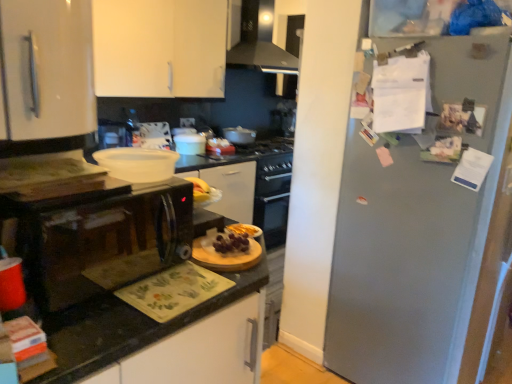
What do you see at coordinates (113, 272) in the screenshot?
I see `black granite countertop at center` at bounding box center [113, 272].

Where is `white matte cabinet at upper left`? The image size is (512, 384). white matte cabinet at upper left is located at coordinates (159, 48).

Describe the element at coordinates (239, 135) in the screenshot. I see `matte white pot at center, marked as the 2th appliance in a right-to-left arrangement` at that location.

The image size is (512, 384). Identify the location of white matte bowl at center. (137, 163).

Is metallic silver range hood at upper center in front of or behind yellow matte bananas at center, arranged as the second food when viewed from the front, in the image?

Clearly, metallic silver range hood at upper center is behind yellow matte bananas at center, arranged as the second food when viewed from the front.

Is metallic silver range hood at upper center to the left or to the right of yellow matte bananas at center, arranged as the second food when viewed from the front, in the image?

In the image, metallic silver range hood at upper center appears on the right side of yellow matte bananas at center, arranged as the second food when viewed from the front.

Does metallic silver range hood at upper center have a smaller size compared to yellow matte bananas at center, arranged as the second food when viewed from the front?

No, metallic silver range hood at upper center is not smaller than yellow matte bananas at center, arranged as the second food when viewed from the front.

Is metallic silver range hood at upper center far away from yellow matte bananas at center, which appears as the 2th food when ordered from the bottom?

Indeed, metallic silver range hood at upper center is not near yellow matte bananas at center, which appears as the 2th food when ordered from the bottom.

From a real-world perspective, is metallic silver range hood at upper center positioned over satin silver kettle at upper center, the third appliance when ordered from left to right, based on gravity?

Yes, from a real-world perspective, metallic silver range hood at upper center is on top of satin silver kettle at upper center, the third appliance when ordered from left to right.

Is metallic silver range hood at upper center positioned far away from satin silver kettle at upper center, the third appliance when ordered from left to right?

No, metallic silver range hood at upper center is in close proximity to satin silver kettle at upper center, the third appliance when ordered from left to right.

Considering the points (259, 15) and (275, 115), which point is in front, point (259, 15) or point (275, 115)?

The point (259, 15) is more forward.

Is the position of metallic silver range hood at upper center less distant than that of satin silver kettle at upper center, the first appliance when ordered from back to front?

Yes, it is in front of satin silver kettle at upper center, the first appliance when ordered from back to front.

Which of these two, white matte cabinet at upper left or slightly glossy wooden cutting board at center, placed as the 1th food when sorted from front to back, stands shorter?

Standing shorter between the two is slightly glossy wooden cutting board at center, placed as the 1th food when sorted from front to back.

From a real-world perspective, who is located lower, white matte cabinet at upper left or slightly glossy wooden cutting board at center, the 1th food viewed from the right?

slightly glossy wooden cutting board at center, the 1th food viewed from the right, from a real-world perspective.

Does white matte cabinet at upper left appear on the right side of slightly glossy wooden cutting board at center, the 1th food viewed from the right?

In fact, white matte cabinet at upper left is to the left of slightly glossy wooden cutting board at center, the 1th food viewed from the right.

Locate an element on the screen. The image size is (512, 384). home appliance behind the white matte cabinet at upper left is located at coordinates (260, 41).

Is metallic silver range hood at upper center inside the boundaries of white matte cabinet at upper left, or outside?

metallic silver range hood at upper center is outside white matte cabinet at upper left.

Does metallic silver range hood at upper center have a larger size compared to white matte cabinet at upper left?

Yes.

Is metallic silver range hood at upper center taller or shorter than white matte cabinet at upper left?

metallic silver range hood at upper center is shorter than white matte cabinet at upper left.

From the image's perspective, count 1st appliances downward from the white matte cabinet at upper left and point to it. Please provide its 2D coordinates.

[(284, 117)]

In the image, is white matte cabinet at upper left positioned in front of or behind satin silver kettle at upper center, the third appliance when ordered from left to right?

In the image, white matte cabinet at upper left appears in front of satin silver kettle at upper center, the third appliance when ordered from left to right.

Considering the sizes of white matte cabinet at upper left and satin silver kettle at upper center, the first appliance from the right, in the image, is white matte cabinet at upper left wider or thinner than satin silver kettle at upper center, the first appliance from the right,?

white matte cabinet at upper left is wider than satin silver kettle at upper center, the first appliance from the right.

Who is bigger, white matte cabinet at upper left or satin silver kettle at upper center, the first appliance from the right?

With larger size is white matte cabinet at upper left.

Considering their positions, is metallic silver range hood at upper center located in front of or behind metallic gray refrigerator at right?

In the image, metallic silver range hood at upper center appears behind metallic gray refrigerator at right.

Considering the relative positions of metallic silver range hood at upper center and metallic gray refrigerator at right in the image provided, is metallic silver range hood at upper center to the left or to the right of metallic gray refrigerator at right?

From the image, it's evident that metallic silver range hood at upper center is to the left of metallic gray refrigerator at right.

Is metallic silver range hood at upper center far away from metallic gray refrigerator at right?

Yes, metallic silver range hood at upper center and metallic gray refrigerator at right are located far from each other.

How many degrees apart are the facing directions of metallic silver range hood at upper center and metallic gray refrigerator at right?

91.8 degrees.

In the scene shown: Between metallic silver range hood at upper center and slightly glossy wooden cutting board at center, placed as the 1th food when sorted from front to back, which one has smaller width?

slightly glossy wooden cutting board at center, placed as the 1th food when sorted from front to back, is thinner.

Would you say metallic silver range hood at upper center is to the left or to the right of slightly glossy wooden cutting board at center, arranged as the 2th food when viewed from the back, in the picture?

metallic silver range hood at upper center is to the right of slightly glossy wooden cutting board at center, arranged as the 2th food when viewed from the back.

Between metallic silver range hood at upper center and slightly glossy wooden cutting board at center, the 1th food viewed from the right, which one is positioned in front?

slightly glossy wooden cutting board at center, the 1th food viewed from the right, is closer to the camera.

Is metallic silver range hood at upper center inside the boundaries of slightly glossy wooden cutting board at center, arranged as the 2th food when viewed from the left, or outside?

metallic silver range hood at upper center is not inside slightly glossy wooden cutting board at center, arranged as the 2th food when viewed from the left, it's outside.

Where is `home appliance that appears above the yellow matte bananas at center, arranged as the second food when viewed from the front (from the image's perspective)`? home appliance that appears above the yellow matte bananas at center, arranged as the second food when viewed from the front (from the image's perspective) is located at coordinates (260, 41).

In order to click on appliance that is the 1st one below the metallic silver range hood at upper center (from a real-world perspective) in this screenshot , I will do `click(284, 117)`.

Estimate the real-world distances between objects in this image. Which object is further from slightly glossy wooden cutting board at center, the 1th food viewed from the right, matte white pot at center, the second appliance in the left-to-right sequence, or black glossy microwave at left?

matte white pot at center, the second appliance in the left-to-right sequence, is further to slightly glossy wooden cutting board at center, the 1th food viewed from the right.

Estimate the real-world distances between objects in this image. Which object is closer to black granite countertop at center, slightly glossy wooden cutting board at center, arranged as the 2th food when viewed from the left, or metallic gray refrigerator at right?

slightly glossy wooden cutting board at center, arranged as the 2th food when viewed from the left, is positioned closer to the anchor black granite countertop at center.

Considering their positions, is white glossy pot at center, acting as the first appliance starting from the left, positioned closer to matte white pot at center, the second appliance in the left-to-right sequence, than white matte cabinet at upper left?

The object closer to matte white pot at center, the second appliance in the left-to-right sequence, is white glossy pot at center, acting as the first appliance starting from the left.

Considering their positions, is matte white pot at center, marked as the 2th appliance in a right-to-left arrangement, positioned closer to metallic gray refrigerator at right than white matte bowl at center?

white matte bowl at center.

From the image, which object appears to be farther from white matte cabinet at upper left, metallic gray refrigerator at right or black granite countertop at center?

The object further to white matte cabinet at upper left is metallic gray refrigerator at right.

Based on their spatial positions, is yellow matte bananas at center, the first food in the left-to-right sequence, or slightly glossy wooden cutting board at center, arranged as the 2th food when viewed from the back, further from white matte cabinet at upper left?

slightly glossy wooden cutting board at center, arranged as the 2th food when viewed from the back.

Considering their positions, is yellow matte bananas at center, which is the first food in back-to-front order, positioned further to matte white pot at center, the second appliance positioned from the front, than white matte bowl at center?

white matte bowl at center is positioned further to the anchor matte white pot at center, the second appliance positioned from the front.

Considering their positions, is black granite countertop at center positioned closer to black glossy microwave at left than yellow matte bananas at center, which is the first food in back-to-front order?

The object closer to black glossy microwave at left is yellow matte bananas at center, which is the first food in back-to-front order.

Image resolution: width=512 pixels, height=384 pixels. Identify the location of cabinetry between metallic gray refrigerator at right and matte white pot at center, the second appliance in the left-to-right sequence, in the front-back direction. (159, 48).

Image resolution: width=512 pixels, height=384 pixels. Find the location of `food between black glossy microwave at left and yellow matte bananas at center, arranged as the second food when viewed from the front, from front to back`. food between black glossy microwave at left and yellow matte bananas at center, arranged as the second food when viewed from the front, from front to back is located at coordinates (231, 243).

Find the location of a particular element. The image size is (512, 384). kitchen appliance between white matte cabinet at upper left and slightly glossy wooden cutting board at center, the first food in the bottom-to-top sequence, vertically is located at coordinates (137, 163).

Find the location of a particular element. food between slightly glossy wooden cutting board at center, the first food in the bottom-to-top sequence, and white glossy pot at center, placed as the third appliance when sorted from back to front, in the front-back direction is located at coordinates (199, 189).